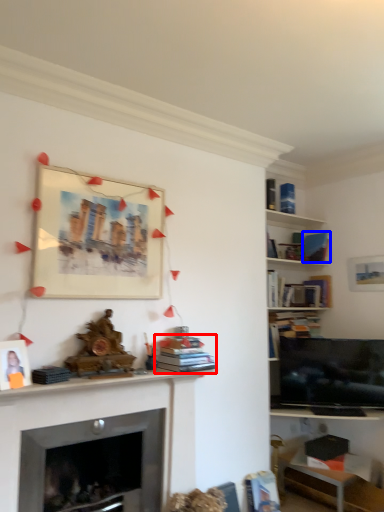
Question: Which object appears farthest to the camera in this image, book (highlighted by a red box) or book (highlighted by a blue box)?

Choices:
 (A) book
 (B) book

Answer: (B)